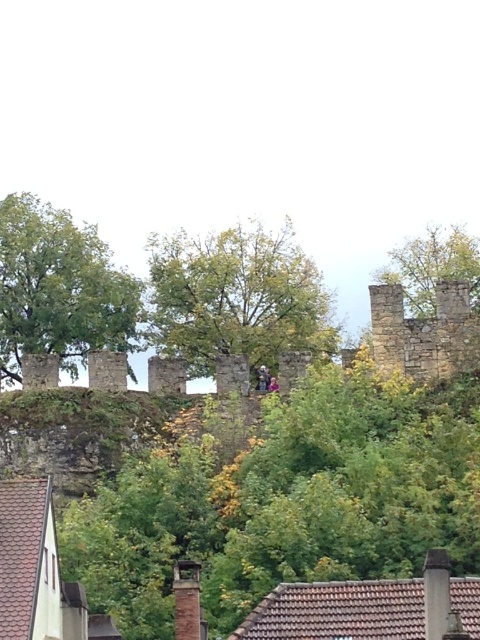
You are a painter standing at the base of the stone wall at upper center and want to paint the green leafy tree at center. Can you see the entire tree without moving your position?

The stone wall at upper center is below the green leafy tree at center, so you cannot see the entire tree because the wall blocks your view of its lower part.

You are an archer positioned behind the historical stone wall. You need to shoot an arrow through the gap between the green leafy tree at center and the green leafy tree at upper center. Which tree is closer to you, and can you see the gap clearly?

The green leafy tree at center is closer to you, so you can see the gap between them clearly.